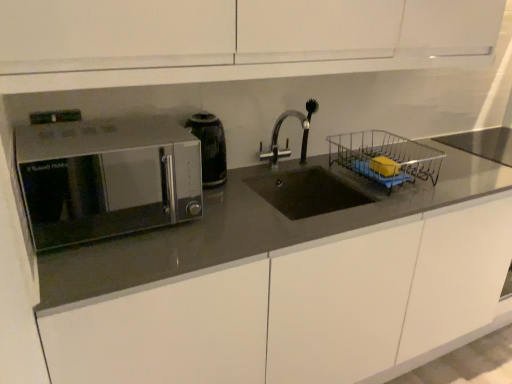
This screenshot has height=384, width=512. Identify the location of free space above satin silver microwave at left (from a real-world perspective). (105, 134).